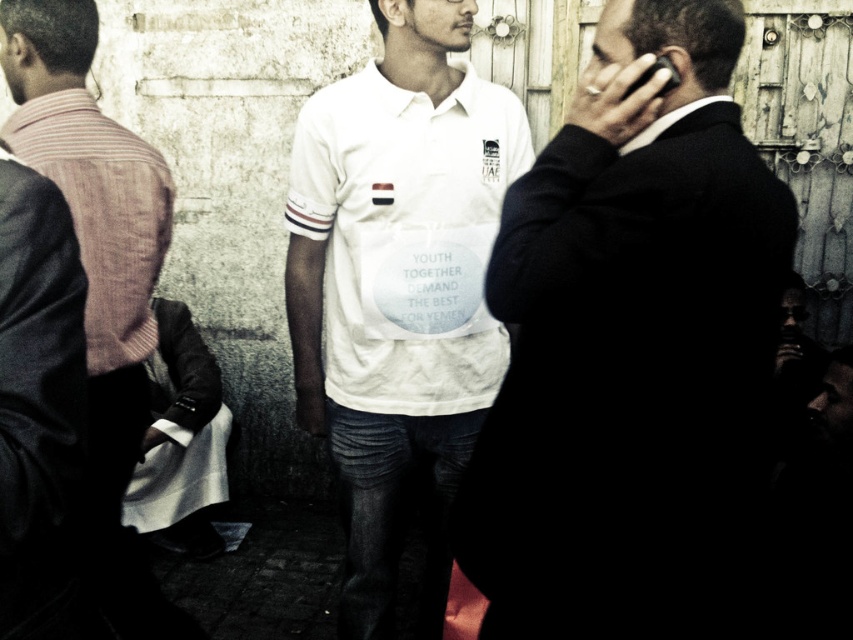
Question: Which of these objects is positioned farthest from the black suit at center?

Choices:
 (A) white cotton shirt at center
 (B) striped fabric shirt at left

Answer: (B)

Question: In this image, where is black suit at center located relative to striped fabric shirt at left?

Choices:
 (A) below
 (B) above

Answer: (B)

Question: Which point is farther from the camera taking this photo?

Choices:
 (A) (343, 310)
 (B) (90, 204)
 (C) (619, 150)

Answer: (A)

Question: Is white cotton shirt at center to the right of striped fabric shirt at left from the viewer's perspective?

Choices:
 (A) no
 (B) yes

Answer: (B)

Question: Does black suit at center appear under striped fabric shirt at left?

Choices:
 (A) yes
 (B) no

Answer: (B)

Question: Which point is farther to the camera?

Choices:
 (A) black suit at center
 (B) white cotton shirt at center

Answer: (B)